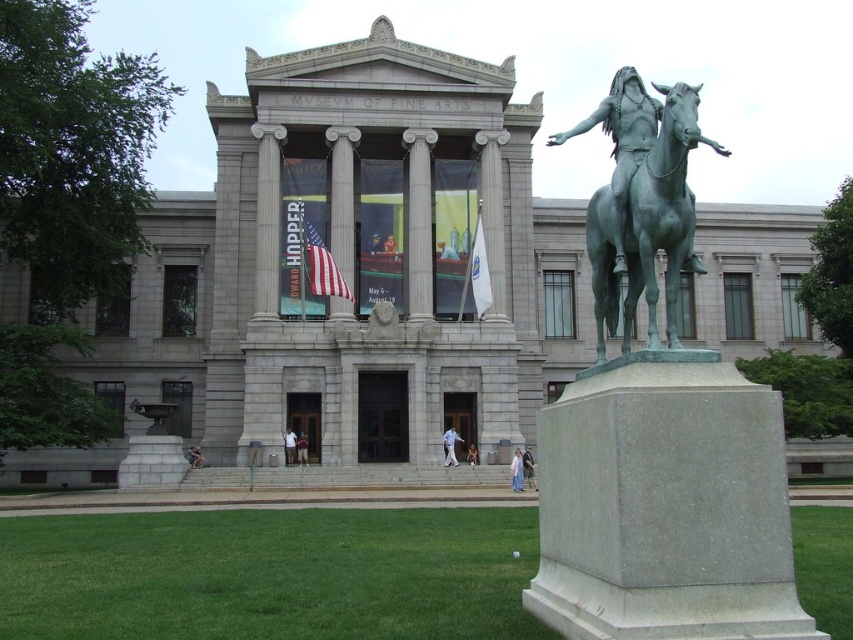
Can you confirm if white fabric flag at center is positioned to the right of light blue jeans at center?

Yes, white fabric flag at center is to the right of light blue jeans at center.

Which of these two, white fabric flag at center or light blue jeans at center, stands shorter?

Standing shorter between the two is light blue jeans at center.

Where is `white fabric flag at center`? Image resolution: width=853 pixels, height=640 pixels. white fabric flag at center is located at coordinates (479, 272).

Is american flag at center bigger than light brown wooden door at center?

Yes, american flag at center is bigger than light brown wooden door at center.

Between american flag at center and light brown wooden door at center, which one appears on the left side from the viewer's perspective?

From the viewer's perspective, light brown wooden door at center appears more on the left side.

In order to click on american flag at center in this screenshot , I will do [322, 266].

You are a GUI agent. You are given a task and a screenshot of the screen. Output one action in this format:
    pyautogui.click(x=<x>, y=<y>)
    Task: Click on the american flag at center
    
    Given the screenshot: What is the action you would take?
    pyautogui.click(x=322, y=266)

Does point (521, 465) come behind point (473, 461)?

No, it is in front of (473, 461).

Does light blue denim jacket at lower center appear on the left side of light brown wooden chair at center?

Incorrect, light blue denim jacket at lower center is not on the left side of light brown wooden chair at center.

Who is more forward, (x=526, y=472) or (x=469, y=445)?

Positioned in front is point (x=526, y=472).

In order to click on light blue denim jacket at lower center in this screenshot , I will do `click(527, 467)`.